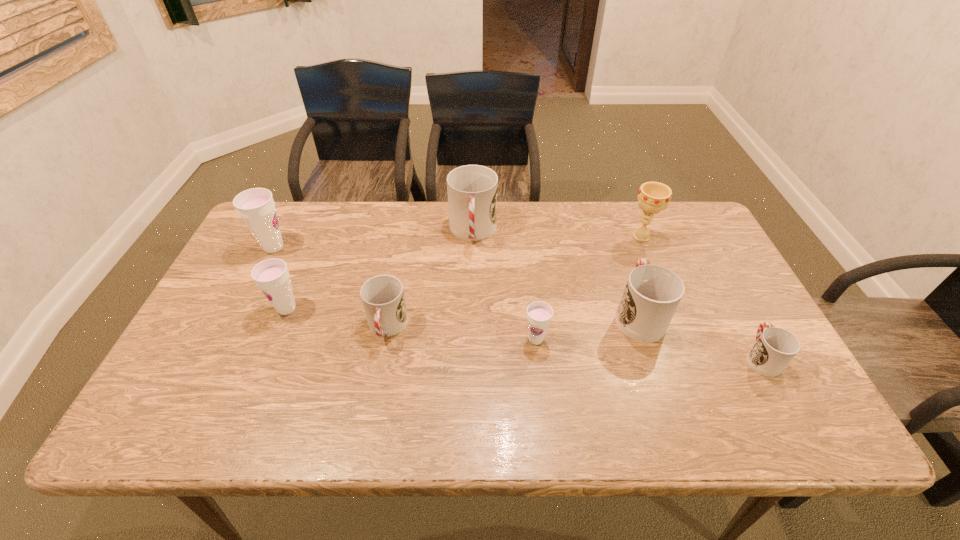
Identify which cup is located as the fourth nearest to the third biggest red cup. Please provide its 2D coordinates. Your answer should be formatted as a tuple, i.e. [(x, y)], where the tuple contains the x and y coordinates of a point satisfying the conditions above.

[(256, 206)]

This screenshot has width=960, height=540. What are the coordinates of `the fifth closest cup relative to the second farthest purple cup` in the screenshot? It's located at click(652, 294).

The image size is (960, 540). Identify the location of purple cup that can be found as the second closest to the leftmost object. (539, 314).

Select which purple cup appears as the closest to the farthest red cup. Please provide its 2D coordinates. Your answer should be formatted as a tuple, i.e. [(x, y)], where the tuple contains the x and y coordinates of a point satisfying the conditions above.

[(539, 314)]

At what (x,y) coordinates should I click in order to perform the action: click on red cup that is the third closest to the second red cup from left to right. Please return your answer as a coordinate pair (x, y). Looking at the image, I should click on (775, 347).

Identify which red cup is the fourth closest to the third cup from right to left. Please provide its 2D coordinates. Your answer should be formatted as a tuple, i.e. [(x, y)], where the tuple contains the x and y coordinates of a point satisfying the conditions above.

[(775, 347)]

Identify the location of free space that satisfies the following two spatial constraints: 1. on the side of the rightmost purple cup where the handle is located; 2. on the right side of the fourth cup from left to right. The image size is (960, 540). (471, 339).

Identify the location of free region that satisfies the following two spatial constraints: 1. on the side of the chalice where the handle is located; 2. on the left side of the third red cup from left to right. This screenshot has height=540, width=960. (612, 237).

The width and height of the screenshot is (960, 540). I want to click on blank space that satisfies the following two spatial constraints: 1. on the side of the fourth object from left to right where the handle is located; 2. on the right side of the smallest purple cup, so click(x=471, y=339).